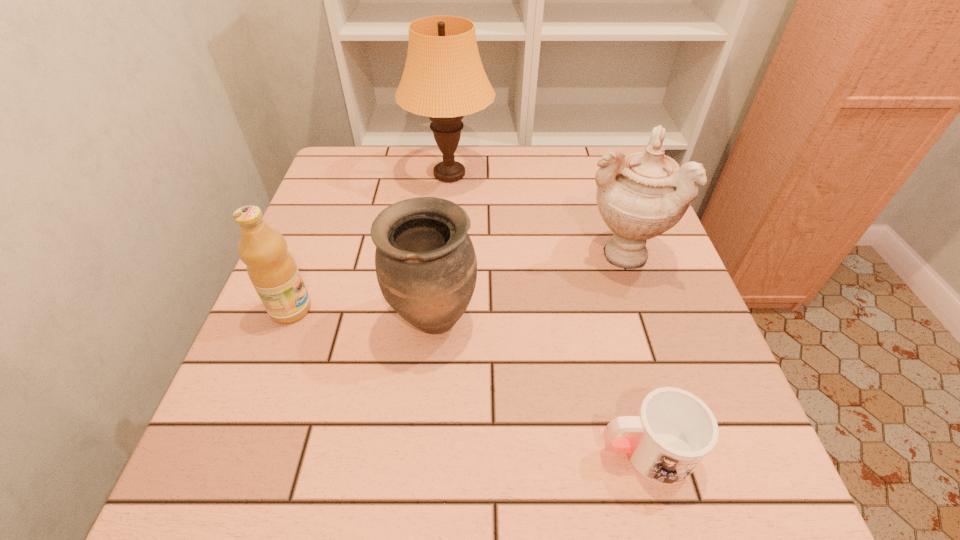
In order to click on mug at the right edge in this screenshot , I will do `click(673, 431)`.

The image size is (960, 540). Find the location of `object that is at the near right corner`. object that is at the near right corner is located at coordinates (673, 431).

Identify the location of free space at the far edge of the desktop. (457, 184).

In the image, there is a desktop. Where is `vacant space at the left edge`? The width and height of the screenshot is (960, 540). vacant space at the left edge is located at coordinates (344, 318).

In the image, there is a desktop. At what (x,y) coordinates should I click in order to perform the action: click on vacant space at the right edge. Please return your answer as a coordinate pair (x, y). Looking at the image, I should click on (597, 218).

At what (x,y) coordinates should I click in order to perform the action: click on free spot at the far left corner of the desktop. Please return your answer as a coordinate pair (x, y). Looking at the image, I should click on (370, 177).

Locate an element on the screen. Image resolution: width=960 pixels, height=540 pixels. vacant space at the near left corner is located at coordinates (192, 471).

I want to click on vacant space at the near right corner of the desktop, so click(x=775, y=484).

Where is `vacant area that lies between the tallest object and the olive oil`? vacant area that lies between the tallest object and the olive oil is located at coordinates (371, 242).

The width and height of the screenshot is (960, 540). I want to click on vacant point located between the mug and the leftmost object, so click(468, 380).